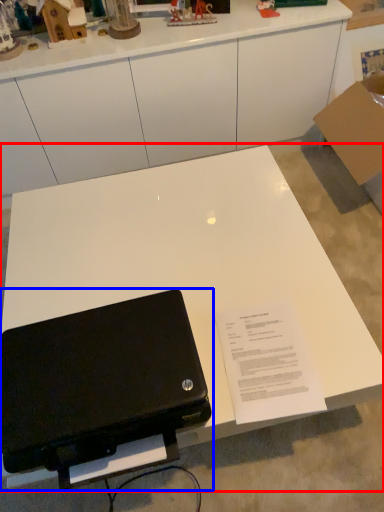
Question: Which object appears farthest to the camera in this image, table (highlighted by a red box) or laptop (highlighted by a blue box)?

Choices:
 (A) table
 (B) laptop

Answer: (A)